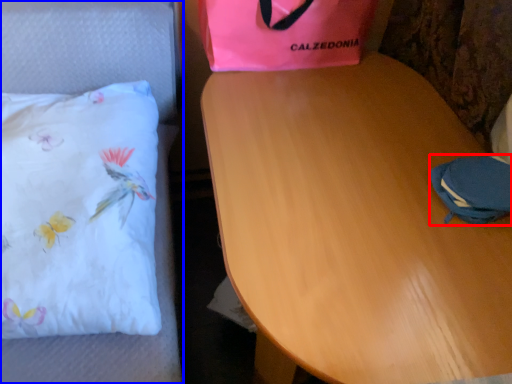
Question: Among these objects, which one is nearest to the camera, pouch (highlighted by a red box) or furniture (highlighted by a blue box)?

Choices:
 (A) pouch
 (B) furniture

Answer: (B)